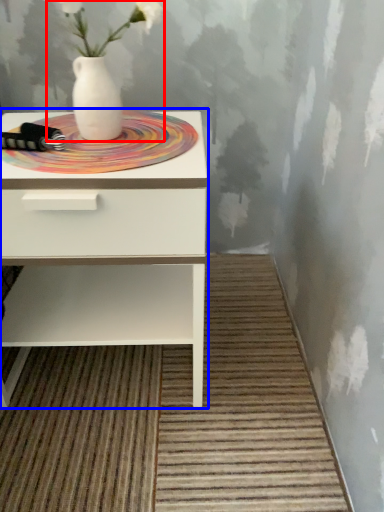
Question: Which point is further to the camera, floral arrangement (highlighted by a red box) or nightstand (highlighted by a blue box)?

Choices:
 (A) floral arrangement
 (B) nightstand

Answer: (B)